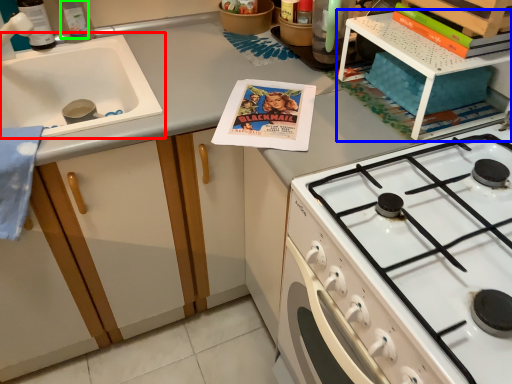
Question: Based on their relative distances, which object is farther from sink (highlighted by a red box)? Choose from shelf (highlighted by a blue box) and bottle (highlighted by a green box).

Choices:
 (A) shelf
 (B) bottle

Answer: (A)